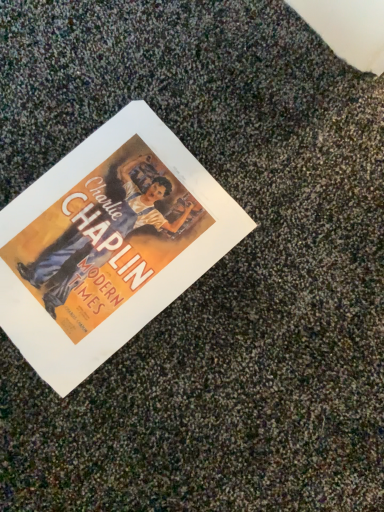
Locate an element on the screen. free space above matte paper poster at center (from a real-world perspective) is located at coordinates (92, 237).